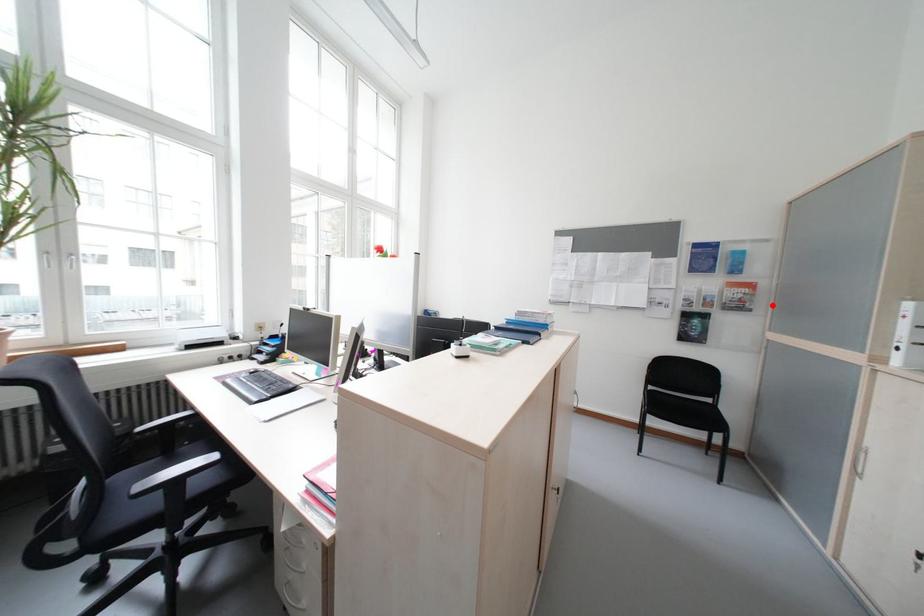
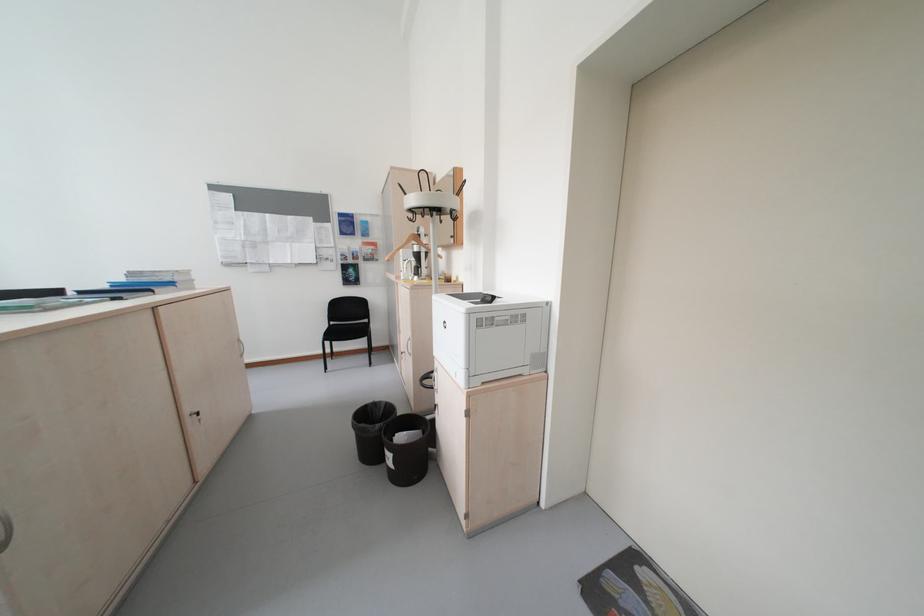
Where in the second image is the point corresponding to the highlighted location from the first image?

(393, 257)